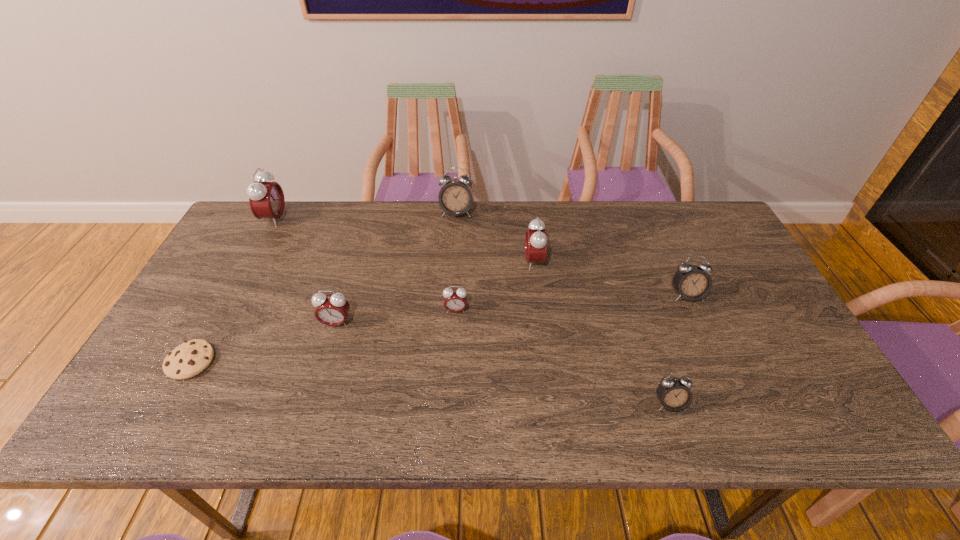
At what (x,y) coordinates should I click in order to perform the action: click on free space between the third nearest alarm clock and the fourth farthest object. Please return your answer as a coordinate pair (x, y). This screenshot has height=540, width=960. Looking at the image, I should click on (571, 302).

Locate an element on the screen. This screenshot has width=960, height=540. vacant area that lies between the rightmost white alarm clock and the second farthest pink alarm clock is located at coordinates point(611,279).

You are a GUI agent. You are given a task and a screenshot of the screen. Output one action in this format:
    pyautogui.click(x=<x>, y=<y>)
    Task: Click on the vacant space that is in between the nearest pink alarm clock and the third smallest pink alarm clock
    This screenshot has height=540, width=960.
    Given the screenshot: What is the action you would take?
    pyautogui.click(x=435, y=293)

Locate an element on the screen. free space between the biggest white alarm clock and the rightmost object is located at coordinates (571, 254).

Image resolution: width=960 pixels, height=540 pixels. I want to click on free space that is in between the fifth farthest object and the rightmost pink alarm clock, so click(x=495, y=286).

This screenshot has height=540, width=960. I want to click on vacant area that lies between the farthest white alarm clock and the second white alarm clock from left to right, so click(563, 308).

Where is `object that ranks as the closest to the farthest white alarm clock`? object that ranks as the closest to the farthest white alarm clock is located at coordinates (536, 240).

Identify which object is located as the seventh nearest to the smallest pink alarm clock. Please provide its 2D coordinates. Your answer should be formatted as a tuple, i.e. [(x, y)], where the tuple contains the x and y coordinates of a point satisfying the conditions above.

[(266, 199)]

Where is `alarm clock that is the second closest one to the second alarm clock from right to left`? This screenshot has height=540, width=960. alarm clock that is the second closest one to the second alarm clock from right to left is located at coordinates (536, 240).

Choose which alarm clock is the fifth nearest neighbor to the second nearest object. Please provide its 2D coordinates. Your answer should be formatted as a tuple, i.e. [(x, y)], where the tuple contains the x and y coordinates of a point satisfying the conditions above.

[(536, 240)]